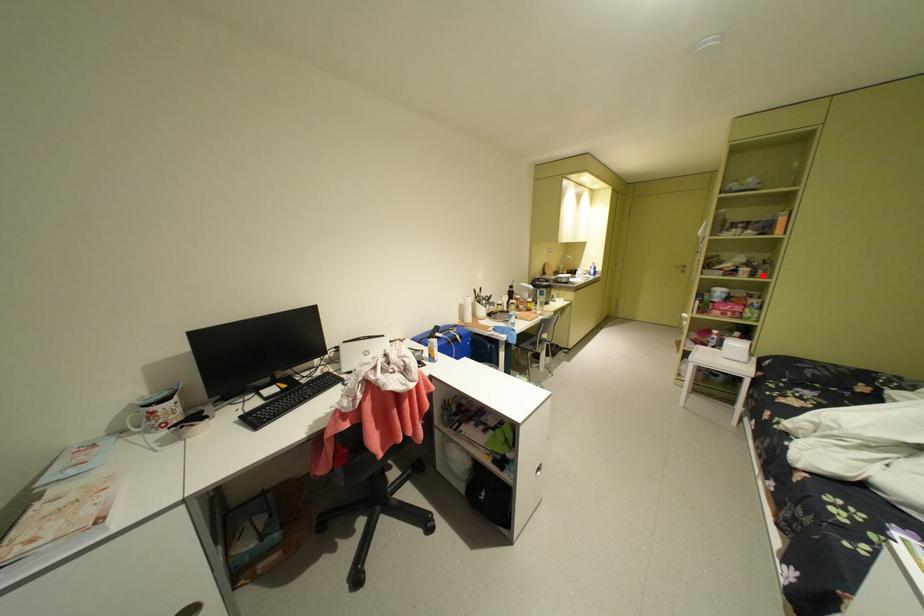
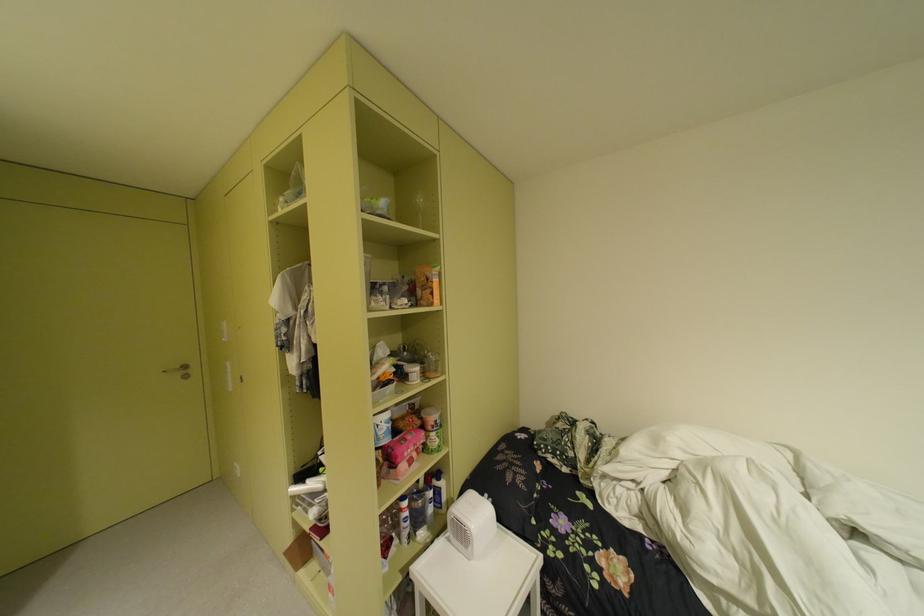
Locate, in the second image, the point that corresponds to the highlighted location in the first image.

(434, 376)